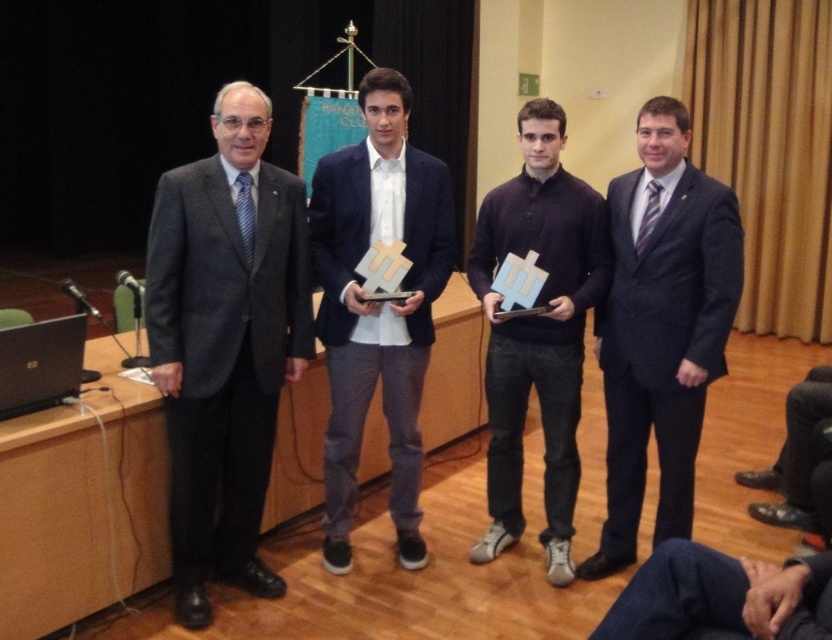
You are organizing a photo shoot and need to place a gray wool suit at left and a silver metallic laptop at left in the same frame. Based on their sizes, which object should you place closer to the camera to ensure both appear proportionate?

The gray wool suit at left is larger in size than the silver metallic laptop at left, so you should place the silver metallic laptop at left closer to the camera to make them appear proportionate.

You are a photographer at the event and want to capture a photo of the gray wool suit at left and the dark blue sweater at center. Which one is positioned more to the left side?

The gray wool suit at left is positioned more to the left side than the dark blue sweater at center.